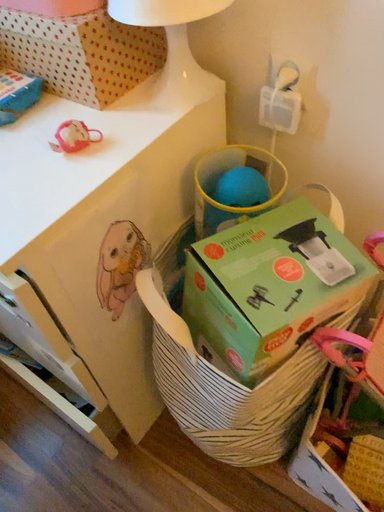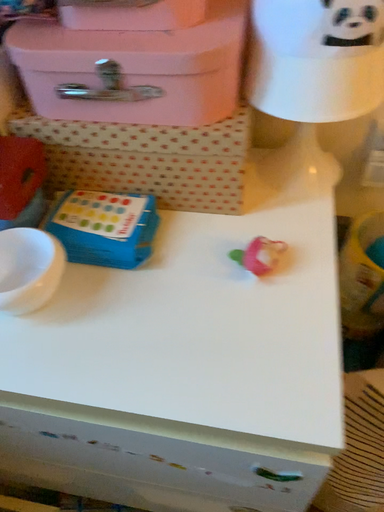
Question: How did the camera likely rotate when shooting the video?

Choices:
 (A) rotated left
 (B) rotated right

Answer: (B)